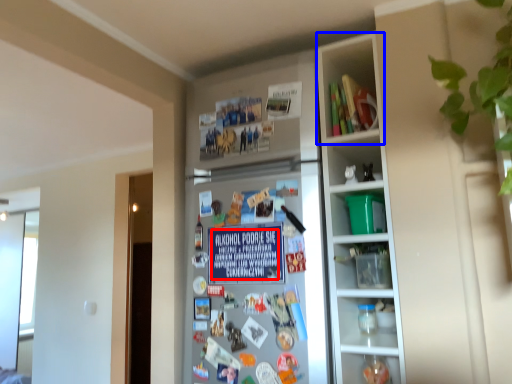
Question: Which point is further to the camera, writing (highlighted by a red box) or cabinet (highlighted by a blue box)?

Choices:
 (A) writing
 (B) cabinet

Answer: (B)